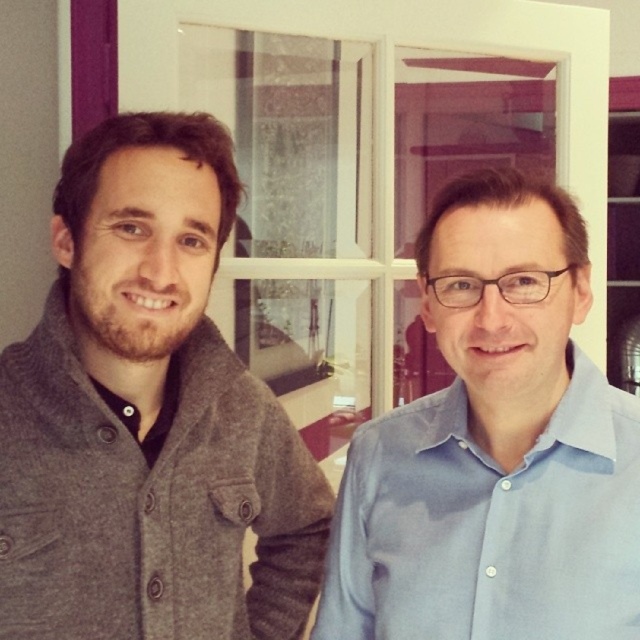
I want to click on gray woolen sweater at left, so (x=147, y=417).

Does gray woolen sweater at left have a smaller size compared to light blue cotton shirt at right?

Actually, gray woolen sweater at left might be larger than light blue cotton shirt at right.

Is point (58, 342) positioned before point (582, 561)?

No.

Identify the location of gray woolen sweater at left. The image size is (640, 640). (147, 417).